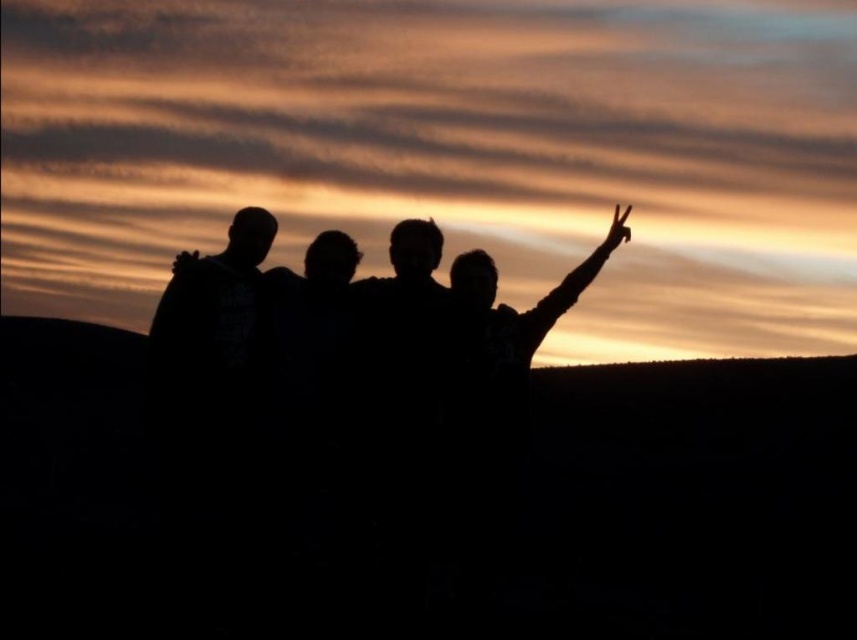
You are a photographer trying to capture the sunset scene. You want to ensure that both the black matte arm at upper right and the black matte arm at upper left are clearly visible in your photo. Given that your camera has a minimum focus distance of 3 meters, will you be able to capture both arms in focus without moving closer?

The distance between the black matte arm at upper right and the black matte arm at upper left is 2.84 meters. Since this distance is less than the camera minimum focus distance of 3 meters, the camera may not be able to keep both arms in focus simultaneously. You might need to adjust your position or use a different camera setting to ensure both arms are clear.

You are a photographer trying to capture the sunset scene. You notice two hands in the frame, the matte black hand at upper right and the black matte hand at center. Which hand is located to the right of the other?

The matte black hand at upper right is positioned on the right side of the black matte hand at center, so the matte black hand at upper right is to the right of the black matte hand at center.

From the picture: You are an artist trying to draw the scene. You want to ensure the proportions between the black matte arm at upper left and the black matte hand at center are accurate. Which one should you draw wider?

The black matte arm at upper left should be drawn wider than the black matte hand at center since its width surpasses the hand.